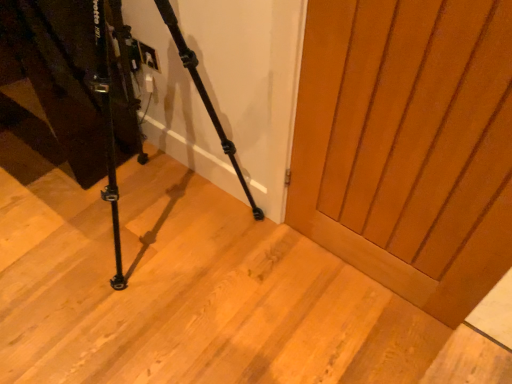
Image resolution: width=512 pixels, height=384 pixels. I want to click on spots to the right of black matte tripod at lower left, so click(298, 297).